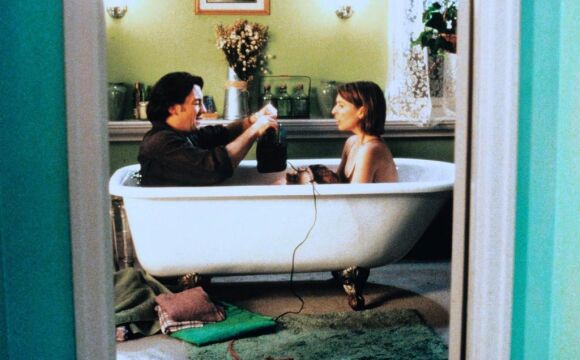
Locate an element on the screen. This screenshot has height=360, width=580. curtain int he window is located at coordinates (419, 75).